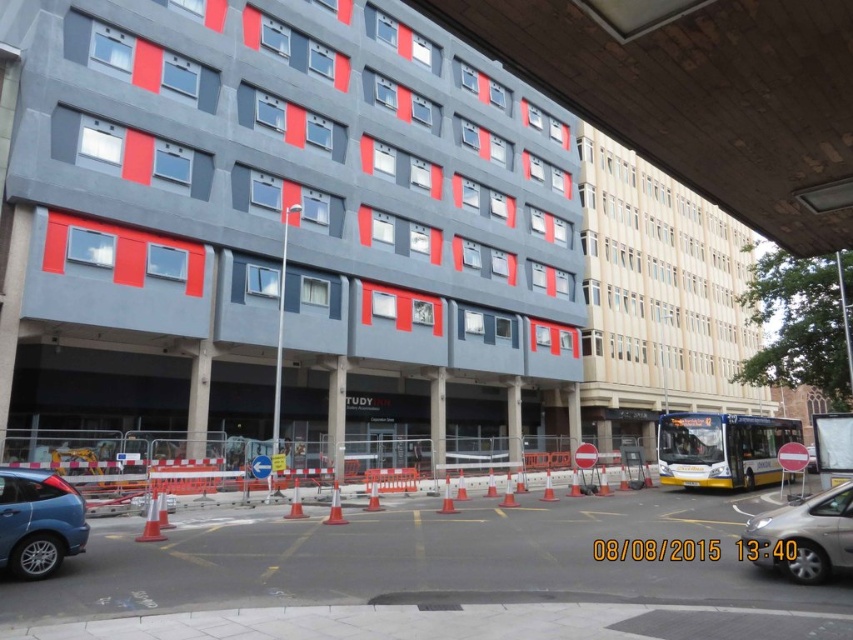
You are a delivery driver who needs to park your metallic blue suv at lower left near the construction zone. According to the scene, can you safely park there without blocking the road sign or the orange traffic cones?

The metallic blue suv at lower left is located at point (38,522) which might be near the construction zone. However, the exact position relative to the road sign and cones isn

You are a pedestrian standing at the crosswalk in front of the multi story building with gray panels and red accents. You see a metallic blue suv at lower left and a silver metallic car at lower right. Which vehicle is blocking the other one?

The metallic blue suv at lower left is positioned over silver metallic car at lower right, so the metallic blue suv at lower left is blocking the silver metallic car at lower right.

You are a delivery driver who needs to park your vehicle in the parking lot behind the multi story building. You see the metallic blue suv at lower left and the silver metallic car at lower right parked there. Which vehicle takes up less space in the parking lot?

The metallic blue suv at lower left occupies less space than silver metallic car at lower right, so the metallic blue suv at lower left takes up less space in the parking lot.